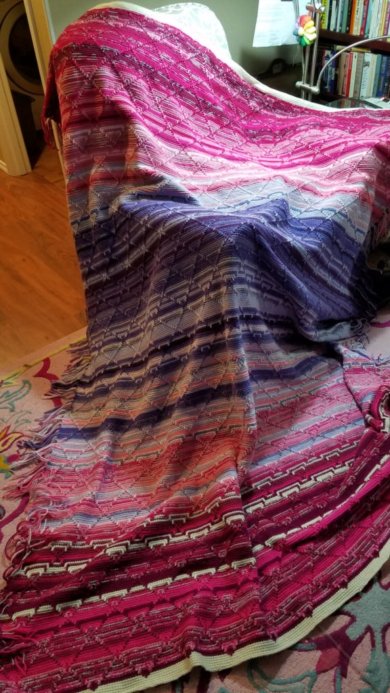
The width and height of the screenshot is (390, 693). Find the location of `floor`. floor is located at coordinates (53, 263).